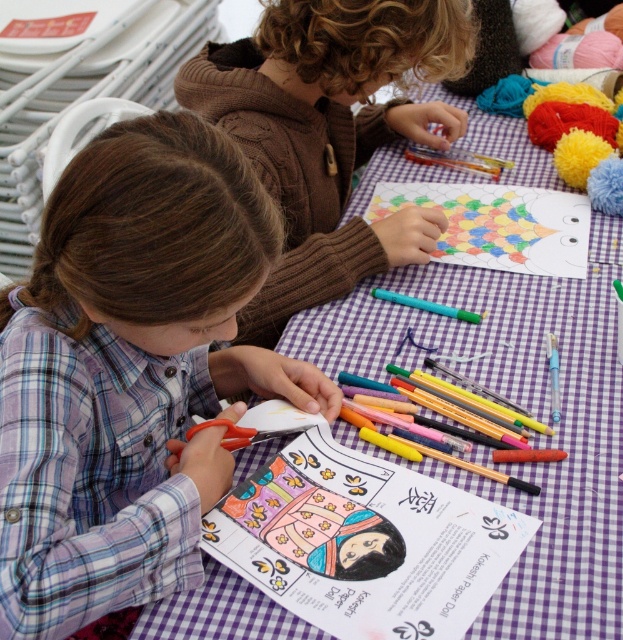
Question: Does plaid fabric shirt at center appear under brown knitted sweater at upper center?

Choices:
 (A) no
 (B) yes

Answer: (B)

Question: Is purple checkered tablecloth at center below brown knitted sweater at upper center?

Choices:
 (A) yes
 (B) no

Answer: (A)

Question: Which point is farther to the camera?

Choices:
 (A) colored paper drawing at center
 (B) plaid fabric shirt at center

Answer: (A)

Question: Which is nearer to the colored paper drawing at center?

Choices:
 (A) green matte marker at center
 (B) purple checkered tablecloth at center
 (C) plaid fabric shirt at center

Answer: (B)

Question: Which object is closer to the camera taking this photo?

Choices:
 (A) brown knitted sweater at upper center
 (B) colored paper drawing at center
 (C) purple checkered tablecloth at center
 (D) plaid fabric shirt at center

Answer: (D)

Question: Is the position of purple checkered tablecloth at center less distant than that of colored paper drawing at center?

Choices:
 (A) yes
 (B) no

Answer: (B)